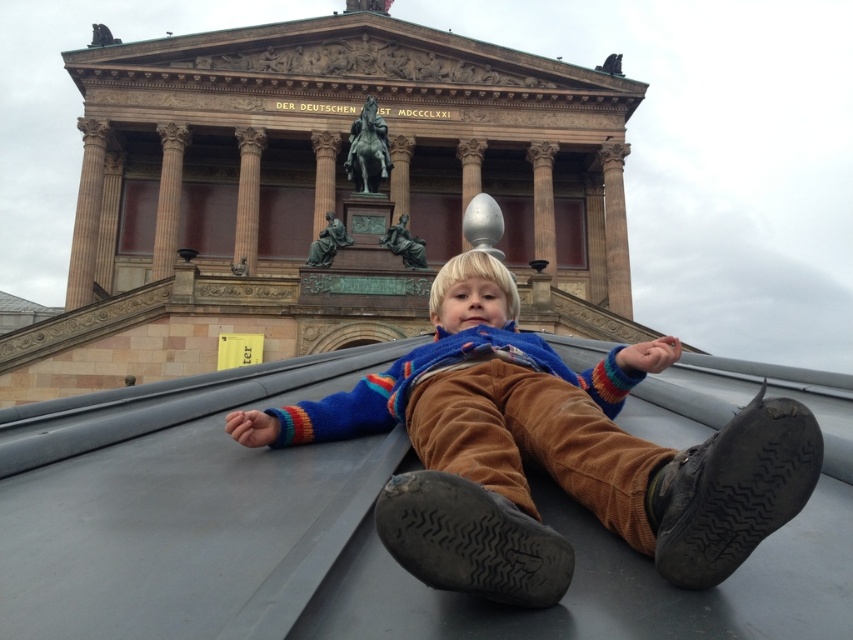
Between smooth stone column at upper left and satin gold column at center, which one appears on the right side from the viewer's perspective?

satin gold column at center

Consider the image. Who is shorter, smooth stone column at upper left or satin gold column at center?

satin gold column at center

Is point (83, 138) less distant than point (471, 154)?

Yes.

Locate an element on the screen. This screenshot has height=640, width=853. smooth stone column at upper left is located at coordinates (86, 214).

Can you confirm if smooth stone column at upper left is thinner than brown stone pillar at center?

No, smooth stone column at upper left is not thinner than brown stone pillar at center.

How much distance is there between smooth stone column at upper left and brown stone pillar at center?

A distance of 80.74 meters exists between smooth stone column at upper left and brown stone pillar at center.

Is point (96, 240) positioned in front of point (614, 170)?

Yes, point (96, 240) is closer to viewer.

Locate an element on the screen. This screenshot has height=640, width=853. smooth stone column at upper left is located at coordinates (86, 214).

Does brown corduroy pants at center come in front of polished stone column at upper center?

Yes, it is in front of polished stone column at upper center.

Can you confirm if brown corduroy pants at center is wider than polished stone column at upper center?

Yes, brown corduroy pants at center is wider than polished stone column at upper center.

Who is more distant from viewer, (608, 412) or (178, 131)?

The point (178, 131) is behind.

Identify the location of brown corduroy pants at center. This screenshot has width=853, height=640. (547, 452).